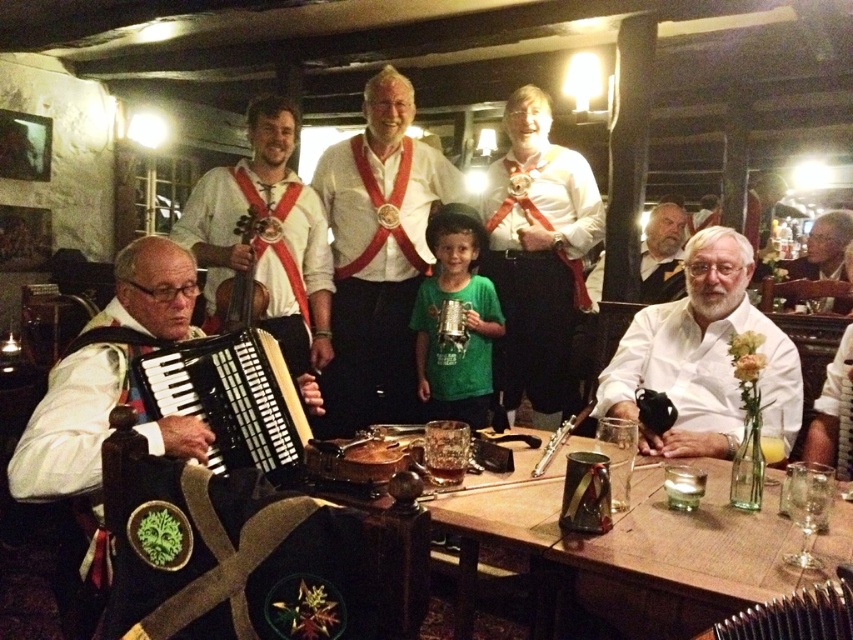
Can you confirm if wooden violin at center is smaller than metallic silver accordion at center?

Incorrect, wooden violin at center is not smaller in size than metallic silver accordion at center.

Which is below, wooden violin at center or metallic silver accordion at center?

metallic silver accordion at center is below.

I want to click on wooden violin at center, so click(239, 300).

The image size is (853, 640). In order to click on wooden violin at center in this screenshot , I will do coord(239,300).

Which is more to the left, wooden table at center or white shirt at upper right?

Positioned to the left is wooden table at center.

Where is `wooden table at center`? wooden table at center is located at coordinates (631, 548).

Which is in front, point (672, 572) or point (822, 220)?

Point (672, 572) is more forward.

At what (x,y) coordinates should I click in order to perform the action: click on wooden table at center. Please return your answer as a coordinate pair (x, y). This screenshot has height=640, width=853. Looking at the image, I should click on (631, 548).

Does wooden table at center lie in front of white matte shirt at right?

That is True.

Locate an element on the screen. Image resolution: width=853 pixels, height=640 pixels. wooden table at center is located at coordinates (631, 548).